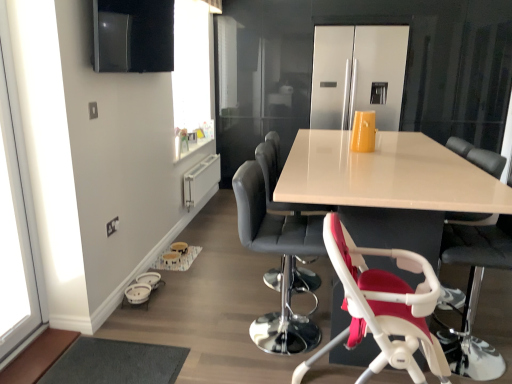
At what (x,y) coordinates should I click in order to perform the action: click on free space between transparent glass window at left and leather-like black chair at center, which is the 1th chair from back to front. Please return your answer as a coordinate pair (x, y). Looking at the image, I should click on (178, 311).